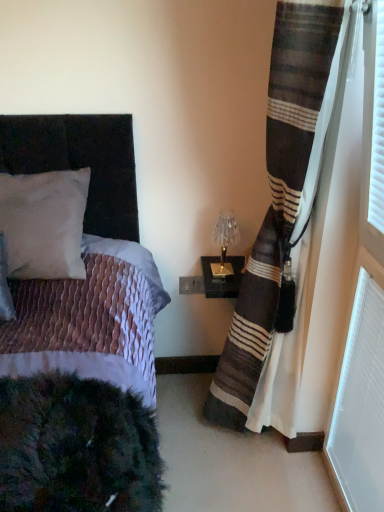
Measure the distance between striped fabric curtain at right and camera.

They are 36.86 inches apart.

Looking at this image, measure the distance between point (227, 276) and camera.

The depth of point (227, 276) is 6.13 feet.

What is the approximate height of gold metallic table lamp at upper right?

10.87 inches.

The width and height of the screenshot is (384, 512). In order to click on striped fabric curtain at right in this screenshot , I will do `click(276, 197)`.

The width and height of the screenshot is (384, 512). I want to click on table lamp on the right side of white matte pillow at upper left, so click(x=225, y=242).

Can you confirm if white matte pillow at upper left is positioned to the left of gold metallic table lamp at upper right?

Correct, you'll find white matte pillow at upper left to the left of gold metallic table lamp at upper right.

From the image's perspective, is white matte pillow at upper left beneath gold metallic table lamp at upper right?

Actually, white matte pillow at upper left appears above gold metallic table lamp at upper right in the image.

Is white matte pillow at upper left facing towards gold metallic table lamp at upper right?

No, white matte pillow at upper left is not aimed at gold metallic table lamp at upper right.

Does gold metallic table lamp at upper right have a greater height compared to white textured radiator at lower right?

In fact, gold metallic table lamp at upper right may be shorter than white textured radiator at lower right.

Which is nearer, (x=237, y=232) or (x=343, y=465)?

Point (x=237, y=232) is farther from the camera than point (x=343, y=465).

Between gold metallic table lamp at upper right and white textured radiator at lower right, which one has smaller size?

gold metallic table lamp at upper right is smaller.

Would you say gold metallic table lamp at upper right is inside or outside striped fabric curtain at right?

gold metallic table lamp at upper right exists outside the volume of striped fabric curtain at right.

Does point (238, 232) lie behind point (241, 284)?

Yes, point (238, 232) is farther from viewer.

Considering the sizes of objects gold metallic table lamp at upper right and striped fabric curtain at right in the image provided, who is taller, gold metallic table lamp at upper right or striped fabric curtain at right?

striped fabric curtain at right is taller.

Is the position of gold metallic table lamp at upper right less distant than that of striped fabric curtain at right?

No, gold metallic table lamp at upper right is further to the viewer.

In order to click on bed that appears on the left of gold metallic table lamp at upper right in this screenshot , I will do `click(81, 392)`.

Is the position of gold metallic table lamp at upper right less distant than that of velvet black bed at left?

No.

Is velvet black bed at left at the back of gold metallic table lamp at upper right?

gold metallic table lamp at upper right does not have its back to velvet black bed at left.

Measure the distance from gold metallic table lamp at upper right to velvet black bed at left.

gold metallic table lamp at upper right is 24.01 inches away from velvet black bed at left.

Which is correct: white textured radiator at lower right is inside gold metallic table lamp at upper right, or outside of it?

The correct answer is: outside.

From the image's perspective, which object appears higher, white textured radiator at lower right or gold metallic table lamp at upper right?

From the image's view, gold metallic table lamp at upper right is above.

Is white textured radiator at lower right wider than gold metallic table lamp at upper right?

Incorrect, the width of white textured radiator at lower right does not surpass that of gold metallic table lamp at upper right.

Can you tell me how much white textured radiator at lower right and gold metallic table lamp at upper right differ in facing direction?

There is a 90.9-degree angle between the facing directions of white textured radiator at lower right and gold metallic table lamp at upper right.

Which object is wider, white textured radiator at lower right or white matte pillow at upper left?

Wider between the two is white matte pillow at upper left.

From a real-world perspective, who is located higher, white textured radiator at lower right or white matte pillow at upper left?

In real-world perspective, white matte pillow at upper left is above.

Locate an element on the screen. The width and height of the screenshot is (384, 512). pillow located behind the white textured radiator at lower right is located at coordinates (44, 223).

Is white textured radiator at lower right next to white matte pillow at upper left?

There is a gap between white textured radiator at lower right and white matte pillow at upper left.

Is white textured radiator at lower right placed right next to velvet black bed at left?

No, white textured radiator at lower right is not beside velvet black bed at left.

Is white textured radiator at lower right oriented towards velvet black bed at left?

Yes, white textured radiator at lower right faces towards velvet black bed at left.

Which object is more forward, white textured radiator at lower right or velvet black bed at left?

Positioned in front is velvet black bed at left.

You are a GUI agent. You are given a task and a screenshot of the screen. Output one action in this format:
    pyautogui.click(x=<x>, y=<y>)
    Task: Click on the pillow above the gold metallic table lamp at upper right (from a real-world perspective)
    Image resolution: width=384 pixels, height=512 pixels.
    Given the screenshot: What is the action you would take?
    pyautogui.click(x=44, y=223)

The image size is (384, 512). I want to click on window in front of the gold metallic table lamp at upper right, so click(x=361, y=403).

Estimate the real-world distances between objects in this image. Which object is closer to gold metallic table lamp at upper right, white matte pillow at upper left or striped fabric curtain at right?

The object closer to gold metallic table lamp at upper right is striped fabric curtain at right.

Considering their positions, is white textured radiator at lower right positioned closer to white matte pillow at upper left than velvet black bed at left?

Among the two, velvet black bed at left is located nearer to white matte pillow at upper left.

Based on their spatial positions, is velvet black bed at left or gold metallic table lamp at upper right closer to striped fabric curtain at right?

gold metallic table lamp at upper right lies closer to striped fabric curtain at right than the other object.

Looking at the image, which one is located closer to velvet black bed at left, white textured radiator at lower right or gold metallic table lamp at upper right?

Based on the image, gold metallic table lamp at upper right appears to be nearer to velvet black bed at left.

Based on the photo, looking at the image, which one is located closer to velvet black bed at left, gold metallic table lamp at upper right or striped fabric curtain at right?

The object closer to velvet black bed at left is striped fabric curtain at right.

Based on their spatial positions, is striped fabric curtain at right or gold metallic table lamp at upper right closer to white matte pillow at upper left?

Among the two, gold metallic table lamp at upper right is located nearer to white matte pillow at upper left.

Looking at the image, which one is located closer to white textured radiator at lower right, gold metallic table lamp at upper right or velvet black bed at left?

The object closer to white textured radiator at lower right is gold metallic table lamp at upper right.

From the image, which object appears to be farther from striped fabric curtain at right, white matte pillow at upper left or white textured radiator at lower right?

white matte pillow at upper left.

The width and height of the screenshot is (384, 512). I want to click on pillow positioned between velvet black bed at left and gold metallic table lamp at upper right from near to far, so click(44, 223).

I want to click on table lamp between white matte pillow at upper left and white textured radiator at lower right from left to right, so click(225, 242).

Locate an element on the screen. curtain positioned between velvet black bed at left and gold metallic table lamp at upper right from near to far is located at coordinates (276, 197).

You are a GUI agent. You are given a task and a screenshot of the screen. Output one action in this format:
    pyautogui.click(x=<x>, y=<y>)
    Task: Click on the curtain located between velvet black bed at left and white textured radiator at lower right in the left-right direction
    
    Given the screenshot: What is the action you would take?
    pyautogui.click(x=276, y=197)